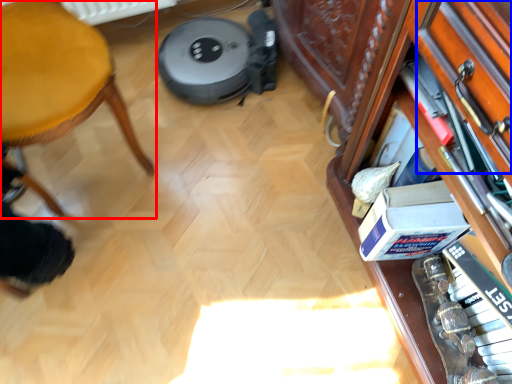
Question: Which object appears closest to the camera in this image, furniture (highlighted by a red box) or drawer (highlighted by a blue box)?

Choices:
 (A) furniture
 (B) drawer

Answer: (A)